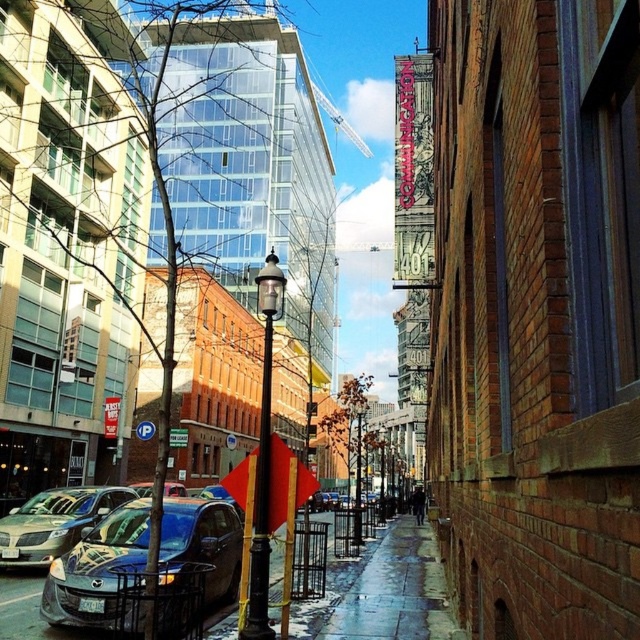
Question: Which of the following is the farthest from the observer?

Choices:
 (A) (269, 257)
 (B) (68, 525)
 (C) (196, 529)

Answer: (B)

Question: Which point is farther to the camera?

Choices:
 (A) wet concrete sidewalk at center
 (B) black metal/texture lamp post at center
 (C) shiny silver sedan at left
 (D) shiny blue sedan at lower left

Answer: (C)

Question: Can you confirm if wet concrete sidewalk at center is positioned to the right of black metal/texture lamp post at center?

Choices:
 (A) yes
 (B) no

Answer: (A)

Question: In this image, where is shiny blue sedan at lower left located relative to black metal/texture lamp post at center?

Choices:
 (A) below
 (B) above

Answer: (A)

Question: Which point is closer to the camera?

Choices:
 (A) (243, 628)
 (B) (371, 630)
 (C) (224, 566)
 (D) (33, 557)

Answer: (A)

Question: Can you confirm if shiny silver sedan at left is positioned to the left of black metal/texture lamp post at center?

Choices:
 (A) yes
 (B) no

Answer: (A)